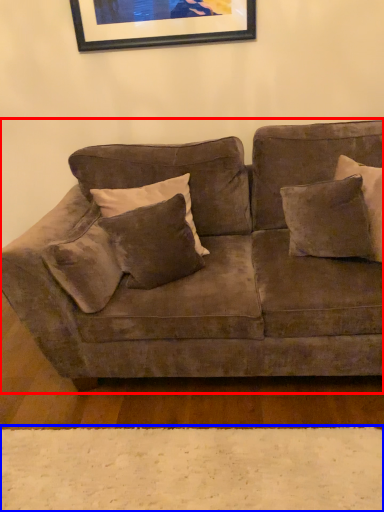
Question: Which point is further to the camera, studio couch (highlighted by a red box) or plain (highlighted by a blue box)?

Choices:
 (A) studio couch
 (B) plain

Answer: (B)